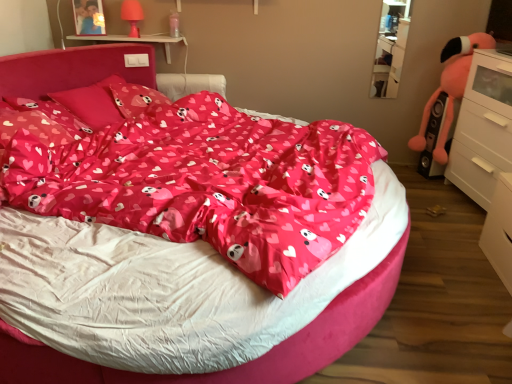
Question: From their relative heights in the image, would you say fluffy pink stuffed animal at right is taller or shorter than clear glass shelf at upper right?

Choices:
 (A) short
 (B) tall

Answer: (B)

Question: Is point (459, 82) closer or farther from the camera than point (386, 87)?

Choices:
 (A) closer
 (B) farther

Answer: (A)

Question: Estimate the real-world distances between objects in this image. Which object is closer to the matte pink plastic table lamp at upper left?

Choices:
 (A) matte pink pillow at center, the second pillow from the front
 (B) white plastic table at upper center
 (C) white glossy chest of drawers at right
 (D) fluffy pink stuffed animal at right
 (E) matte pink pillow at upper left, arranged as the 1th pillow when viewed from the front

Answer: (B)

Question: Considering the real-world distances, which object is farthest from the matte pink pillow at upper left, arranged as the 1th pillow when viewed from the front?

Choices:
 (A) white glossy chest of drawers at right
 (B) matte pink bed at center
 (C) matte pink pillow at center, which is counted as the first pillow, starting from the back
 (D) clear glass shelf at upper right
 (E) matte pink pillow at center, arranged as the 2th pillow when viewed from the back

Answer: (D)